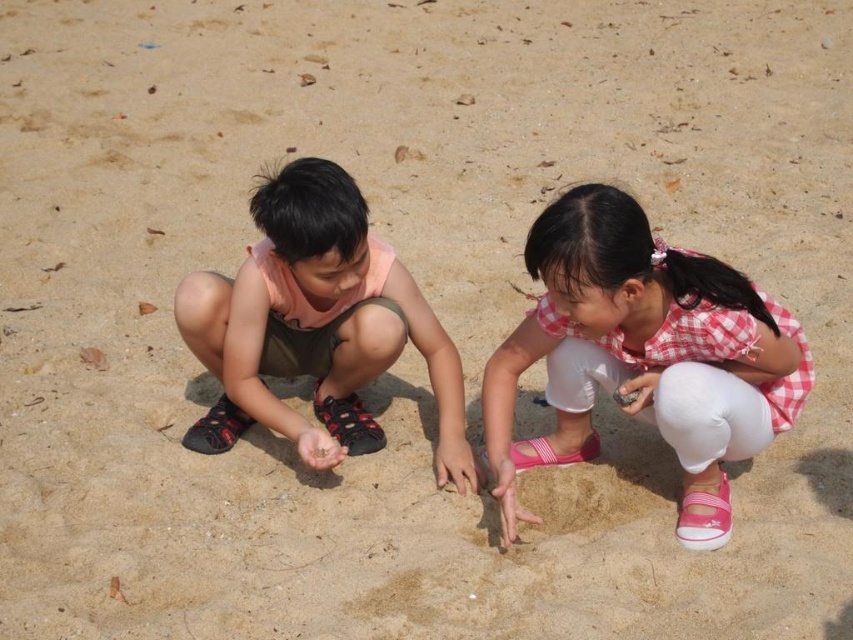
You are a photographer trying to capture a clear shot of both the pink checkered shirt at center and the matte pink shirt at center. Given their height difference, which shirt will appear smaller in the photo?

The pink checkered shirt at center will appear smaller in the photo because it has a lesser height compared to the matte pink shirt at center.

You are a photographer trying to capture the children playing. You want to position your camera at the center of the image to focus on the pink checkered shirt at center. What are the coordinates where you should aim your camera?

The coordinates to aim the camera are at point (643, 355) to focus on the pink checkered shirt at center.

Two children are playing on a sandy beach. The boy is on the left, wearing a peach sleeveless shirt and dark brown shorts, while the girl on the right is in a red and white checkered dress. They are both crouched down. If you want to place a picnic blanket between them so that it covers both of them equally, where should you place it? The coordinates for the point between them are given as point [648,296]. How far apart are they?

The children are 2.52 meters apart. To place the picnic blanket equally between them, you should position it at the midpoint, which is at coordinates [648,296]. This point is exactly halfway between the two children, ensuring the blanket covers both equally.